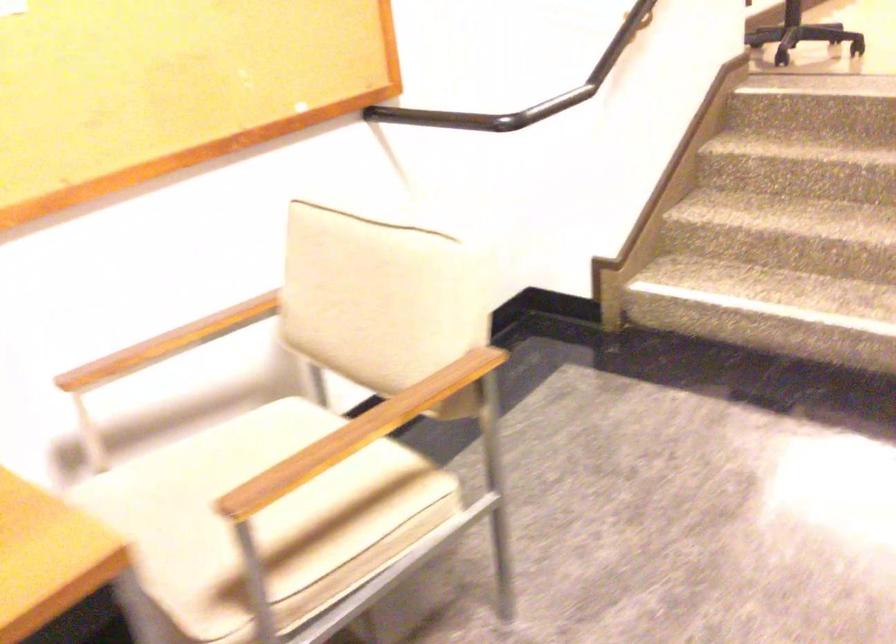
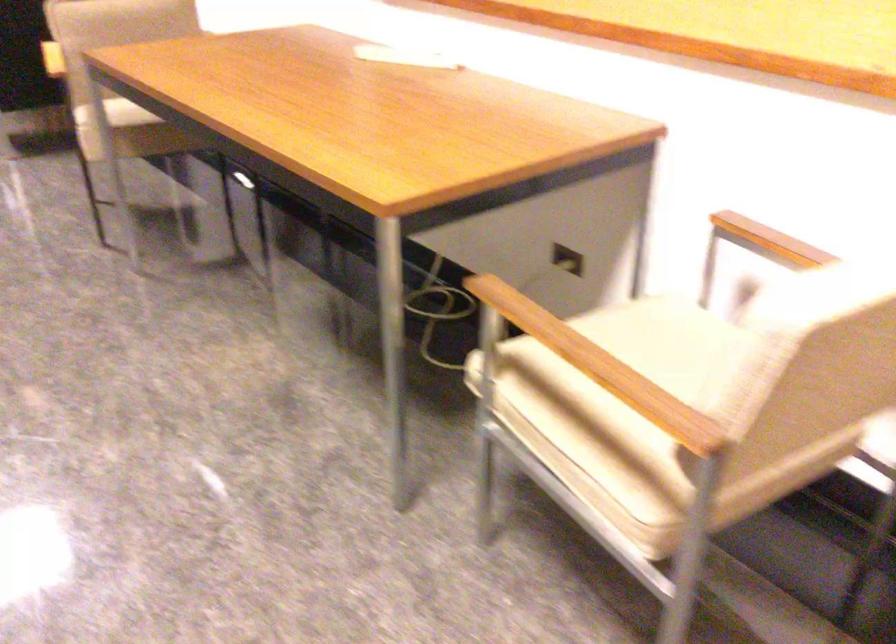
Find the pixel in the second image that matches point (144, 346) in the first image.

(771, 240)